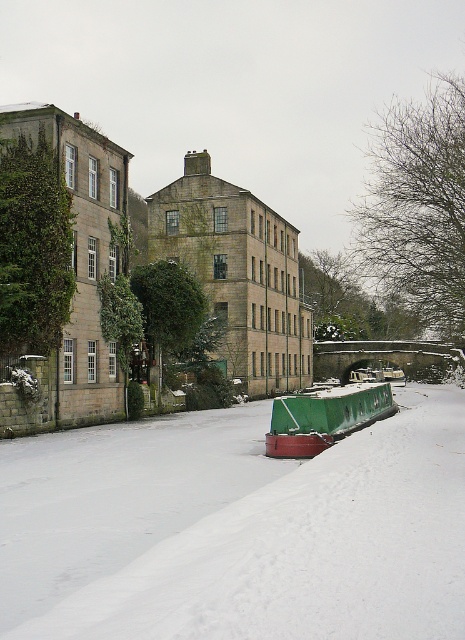
You are standing on the dock near the green matte barge at center and want to walk to the white matte snow at center. Which direction should you move in relation to the barge?

The white matte snow at center is located above the green matte barge at center, so you should move upward or towards the top of the barge to reach the snow.

You are a delivery person trying to navigate a narrow path between the white matte snow at center and the green matte barge at center. Based on the scene description, which object is taller and could potentially block your path?

The white matte snow at center is taller than the green matte barge at center, so it could potentially block your path.

You are standing at the point labeled as point (237, 529) in the center of the image. Looking around, you notice the green canal boat with a red base docked nearby. Which direction should you walk to reach the green canal boat with a red base?

The white matte snow at center is represented by point (237, 529). Since the green canal boat with a red base is docked along the canal edge, you should walk towards the edge of the canal from the center point to reach it.